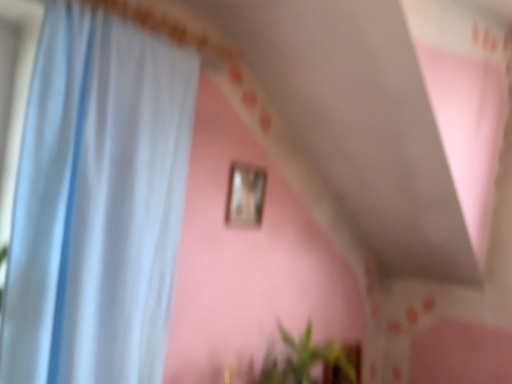
Question: Is green leafy plant at lower center taller or shorter than wooden picture frame at upper center?

Choices:
 (A) short
 (B) tall

Answer: (B)

Question: Considering the positions of green leafy plant at lower center and wooden picture frame at upper center in the image, is green leafy plant at lower center bigger or smaller than wooden picture frame at upper center?

Choices:
 (A) small
 (B) big

Answer: (B)

Question: Which of these objects is positioned farthest from the white sheer curtain at left?

Choices:
 (A) green leafy plant at lower center
 (B) wooden picture frame at upper center

Answer: (A)

Question: Considering the real-world distances, which object is closest to the wooden picture frame at upper center?

Choices:
 (A) white sheer curtain at left
 (B) green leafy plant at lower center

Answer: (B)